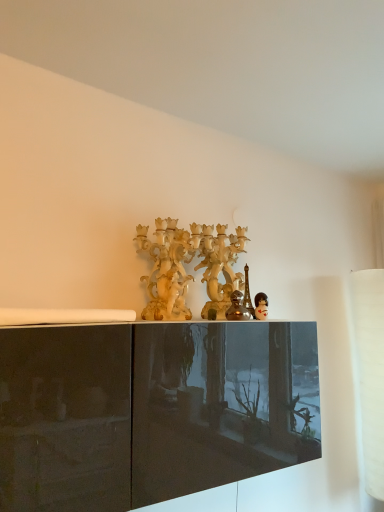
You are a GUI agent. You are given a task and a screenshot of the screen. Output one action in this format:
    pyautogui.click(x=<x>, y=<y>)
    Task: Click on the matte black doll at center
    
    Given the screenshot: What is the action you would take?
    pyautogui.click(x=261, y=306)

Consider the image. Which object is positioned more to the left, matte black doll at center or matte cream candelabra at center?

matte cream candelabra at center.

Consider the image. From the image's perspective, is matte black doll at center located above or below matte cream candelabra at center?

matte black doll at center is situated lower than matte cream candelabra at center in the image.

Consider the image. Is matte black doll at center oriented away from matte cream candelabra at center?

Yes, matte black doll at center is facing away from matte cream candelabra at center.

Which is behind, point (243, 296) or point (206, 254)?

Positioned behind is point (206, 254).

Is matte cream candelabra at center completely or partially inside metallic silver figurine at center?

That's incorrect, matte cream candelabra at center is not inside metallic silver figurine at center.

Can you confirm if metallic silver figurine at center is smaller than matte cream candelabra at center?

Correct, metallic silver figurine at center occupies less space than matte cream candelabra at center.

Which object is further away from the camera taking this photo, metallic silver figurine at center or matte cream candelabra at center?

matte cream candelabra at center is further away from the camera.

Is matte cream candelabra at center to the left of metallic silver figurine at center from the viewer's perspective?

Yes, matte cream candelabra at center is to the left of metallic silver figurine at center.

Considering the sizes of objects matte cream candelabra at center and metallic silver figurine at center in the image provided, who is taller, matte cream candelabra at center or metallic silver figurine at center?

matte cream candelabra at center.

Considering the sizes of matte cream candelabra at center and metallic silver figurine at center in the image, is matte cream candelabra at center wider or thinner than metallic silver figurine at center?

Considering their sizes, matte cream candelabra at center looks broader than metallic silver figurine at center.

Can we say matte cream candelabra at center lies outside metallic silver figurine at center?

Absolutely, matte cream candelabra at center is external to metallic silver figurine at center.

From a real-world perspective, is metallic silver figurine at center located beneath matte black doll at center?

Actually, metallic silver figurine at center is physically above matte black doll at center in the real world.

Is metallic silver figurine at center with matte black doll at center?

Yes, the surface of metallic silver figurine at center is in contact with matte black doll at center.

Which is less distant, (230, 309) or (259, 301)?

Clearly, point (230, 309) is more distant from the camera than point (259, 301).

Is metallic silver figurine at center thinner than matte black doll at center?

Incorrect, the width of metallic silver figurine at center is not less than that of matte black doll at center.

Which of these two, matte black doll at center or metallic silver figurine at center, is wider?

metallic silver figurine at center is wider.

In the image, is matte black doll at center on the left side or the right side of metallic silver figurine at center?

From the image, it's evident that matte black doll at center is to the right of metallic silver figurine at center.

Could you tell me if matte black doll at center is turned towards metallic silver figurine at center?

No, matte black doll at center is not turned towards metallic silver figurine at center.

Is matte black doll at center not within metallic silver figurine at center?

Absolutely, matte black doll at center is external to metallic silver figurine at center.

Locate an element on the screen. The width and height of the screenshot is (384, 512). person that appears below the matte cream candelabra at center (from a real-world perspective) is located at coordinates (261, 306).

Does matte cream candelabra at center turn towards matte black doll at center?

Yes, matte cream candelabra at center is aimed at matte black doll at center.

Is the depth of matte cream candelabra at center greater than that of matte black doll at center?

Yes, the depth of matte cream candelabra at center is greater than that of matte black doll at center.

Is matte cream candelabra at center situated inside matte black doll at center or outside?

matte cream candelabra at center exists outside the volume of matte black doll at center.

You are a GUI agent. You are given a task and a screenshot of the screen. Output one action in this format:
    pyautogui.click(x=<x>, y=<y>)
    Task: Click on the person located underneath the matte cream candelabra at center (from a real-world perspective)
    
    Given the screenshot: What is the action you would take?
    pyautogui.click(x=261, y=306)

The image size is (384, 512). In order to click on collection behind the metallic silver figurine at center in this screenshot , I will do `click(194, 268)`.

From the image, which object appears to be farther from matte cream candelabra at center, matte black doll at center or metallic silver figurine at center?

Among the two, matte black doll at center is located further to matte cream candelabra at center.

When comparing their distances from matte black doll at center, does matte cream candelabra at center or metallic silver figurine at center seem further?

Among the two, matte cream candelabra at center is located further to matte black doll at center.

Considering their positions, is matte cream candelabra at center positioned closer to metallic silver figurine at center than matte black doll at center?

The object closer to metallic silver figurine at center is matte black doll at center.

Considering their positions, is metallic silver figurine at center positioned closer to matte cream candelabra at center than matte black doll at center?

metallic silver figurine at center is positioned closer to the anchor matte cream candelabra at center.

Which object lies further to the anchor point metallic silver figurine at center, matte black doll at center or matte cream candelabra at center?

matte cream candelabra at center.

Estimate the real-world distances between objects in this image. Which object is further from matte black doll at center, metallic silver figurine at center or matte cream candelabra at center?

matte cream candelabra at center lies further to matte black doll at center than the other object.

This screenshot has height=512, width=384. I want to click on figurine between matte cream candelabra at center and matte black doll at center in the up-down direction, so click(237, 308).